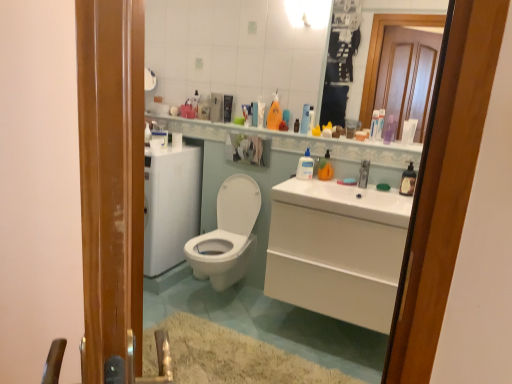
Question: Is white glossy toilet at center spatially inside matte plastic bottle at upper center, marked as the 1th toiletry in a left-to-right arrangement, or outside of it?

Choices:
 (A) outside
 (B) inside

Answer: (A)

Question: Considering the positions of white glossy toilet at center and matte plastic bottle at upper center, marked as the 1th toiletry in a left-to-right arrangement, in the image, is white glossy toilet at center bigger or smaller than matte plastic bottle at upper center, marked as the 1th toiletry in a left-to-right arrangement,?

Choices:
 (A) big
 (B) small

Answer: (A)

Question: Considering the real-world distances, which object is farthest from the translucent plastic bottle at upper center, the 6th toiletry when ordered from right to left?

Choices:
 (A) clear plastic bottle at center, the second cleaning product viewed from the front
 (B) white glossy vanity at lower right
 (C) white glossy sink at center, arranged as the first sink when viewed from the left
 (D) matte plastic container at upper center, the 2th toiletry viewed from the left
 (E) translucent plastic bottle at right, the 4th cleaning product viewed from the back

Answer: (B)

Question: Which object is the farthest from the translucent plastic bottle at right, the 4th cleaning product viewed from the back?

Choices:
 (A) matte plastic bottle at upper center, marked as the 1th toiletry in a left-to-right arrangement
 (B) matte plastic container at upper center, the 2th toiletry viewed from the left
 (C) orange matte bottle at upper center, the third cleaning product in the left-to-right sequence
 (D) clear plastic bottle at upper center, arranged as the fifth toiletry when viewed from the right
 (E) white glossy toilet at center

Answer: (E)